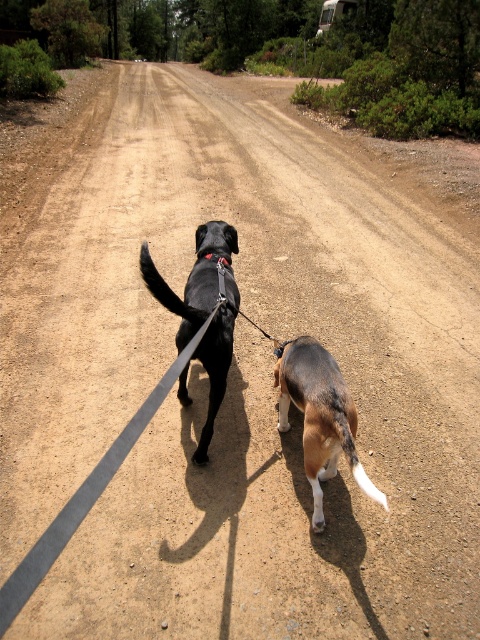
Does brown and white fur at center have a larger size compared to shiny black dog at center?

Actually, brown and white fur at center might be smaller than shiny black dog at center.

Which is below, brown and white fur at center or shiny black dog at center?

Positioned lower is brown and white fur at center.

The image size is (480, 640). What are the coordinates of `brown and white fur at center` in the screenshot? It's located at (320, 417).